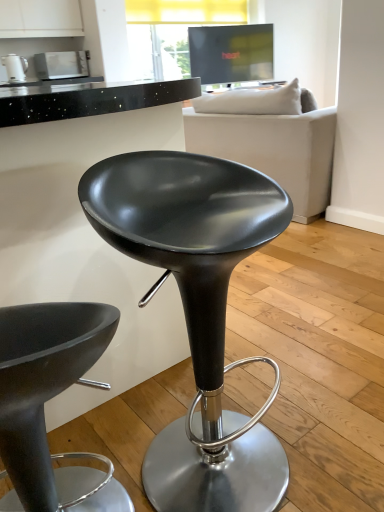
Question: Can you see white fabric couch at upper center touching matte white kettle at upper left, which ranks as the 2th appliance in right-to-left order?

Choices:
 (A) yes
 (B) no

Answer: (B)

Question: Is white fabric couch at upper center aimed at matte white kettle at upper left, which ranks as the 2th appliance in right-to-left order?

Choices:
 (A) yes
 (B) no

Answer: (B)

Question: Can you confirm if white fabric couch at upper center is shorter than matte white kettle at upper left, which ranks as the 2th appliance in right-to-left order?

Choices:
 (A) no
 (B) yes

Answer: (A)

Question: Does white fabric couch at upper center have a smaller size compared to matte white kettle at upper left, which ranks as the 2th appliance in right-to-left order?

Choices:
 (A) yes
 (B) no

Answer: (B)

Question: Considering the relative positions of white fabric couch at upper center and matte white kettle at upper left, which ranks as the 2th appliance in right-to-left order, in the image provided, is white fabric couch at upper center in front of matte white kettle at upper left, which ranks as the 2th appliance in right-to-left order,?

Choices:
 (A) yes
 (B) no

Answer: (A)

Question: Looking at the image, does white fabric couch at upper center seem bigger or smaller compared to matte white kettle at upper left, acting as the second appliance starting from the back?

Choices:
 (A) small
 (B) big

Answer: (B)

Question: Do you think white fabric couch at upper center is within matte white kettle at upper left, marked as the first appliance in a left-to-right arrangement, or outside of it?

Choices:
 (A) outside
 (B) inside

Answer: (A)

Question: Is point (274, 133) positioned closer to the camera than point (14, 65)?

Choices:
 (A) farther
 (B) closer

Answer: (B)

Question: From a real-world perspective, is white fabric couch at upper center physically located above or below matte white kettle at upper left, positioned as the 1th appliance in front-to-back order?

Choices:
 (A) below
 (B) above

Answer: (A)

Question: Would you say matte black stool at center, the first chair from the left, is to the left or to the right of matte white kettle at upper left, positioned as the 1th appliance in front-to-back order, in the picture?

Choices:
 (A) right
 (B) left

Answer: (A)

Question: Considering the positions of matte black stool at center, the first chair from the left, and matte white kettle at upper left, marked as the first appliance in a left-to-right arrangement, in the image, is matte black stool at center, the first chair from the left, taller or shorter than matte white kettle at upper left, marked as the first appliance in a left-to-right arrangement,?

Choices:
 (A) short
 (B) tall

Answer: (B)

Question: From the image's perspective, is matte black stool at center, the first chair from the left, above or below matte white kettle at upper left, positioned as the 1th appliance in front-to-back order?

Choices:
 (A) below
 (B) above

Answer: (A)

Question: Based on their sizes in the image, would you say matte black stool at center, the first chair from the left, is bigger or smaller than matte white kettle at upper left, acting as the second appliance starting from the back?

Choices:
 (A) big
 (B) small

Answer: (A)

Question: Do you think matte black stool at center, the first chair from the left, is within matte white microwave at upper left, which is the second appliance in front-to-back order, or outside of it?

Choices:
 (A) inside
 (B) outside

Answer: (B)

Question: Considering the relative positions of matte black stool at center, which is the 2th chair in right-to-left order, and matte white microwave at upper left, the first appliance viewed from the back, in the image provided, is matte black stool at center, which is the 2th chair in right-to-left order, to the left or to the right of matte white microwave at upper left, the first appliance viewed from the back,?

Choices:
 (A) right
 (B) left

Answer: (A)